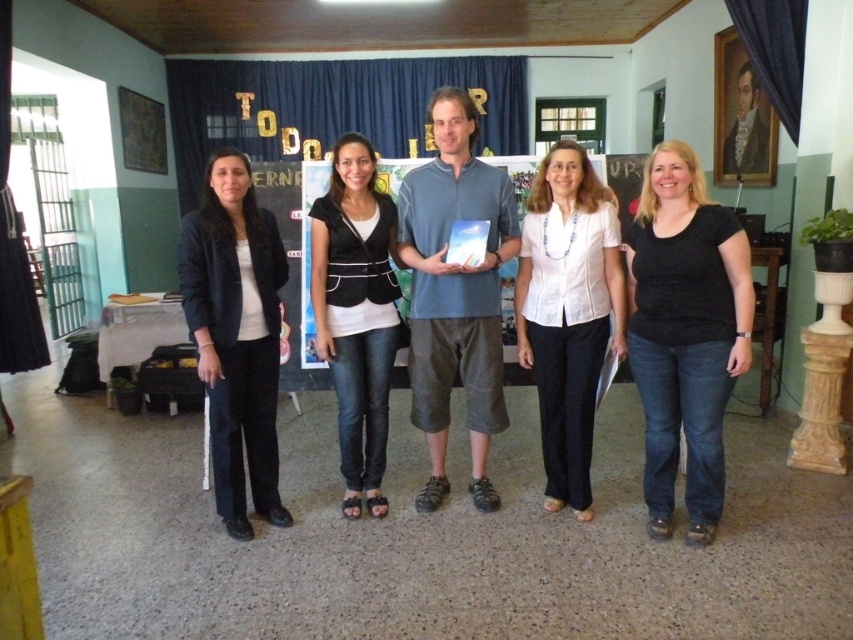
Question: Can you confirm if white matte blouse at center is positioned to the right of black velvet vest at center?

Choices:
 (A) yes
 (B) no

Answer: (A)

Question: Which of these objects is positioned farthest from the matte black blazer at left?

Choices:
 (A) white matte blouse at center
 (B) black matte shirt at center

Answer: (B)

Question: Which of the following is the farthest from the observer?

Choices:
 (A) matte black blazer at left
 (B) black velvet vest at center
 (C) black matte shirt at center

Answer: (B)

Question: Which object is positioned closest to the black matte shirt at center?

Choices:
 (A) black velvet vest at center
 (B) white matte blouse at center

Answer: (B)

Question: Is black matte shirt at center thinner than white matte blouse at center?

Choices:
 (A) no
 (B) yes

Answer: (B)

Question: Can you confirm if black matte shirt at center is smaller than matte black blazer at left?

Choices:
 (A) no
 (B) yes

Answer: (B)